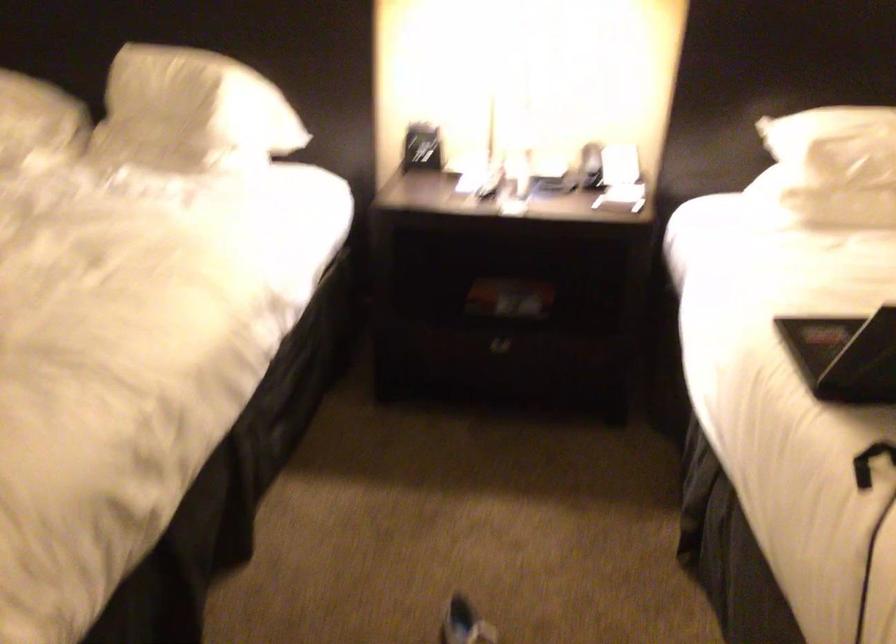
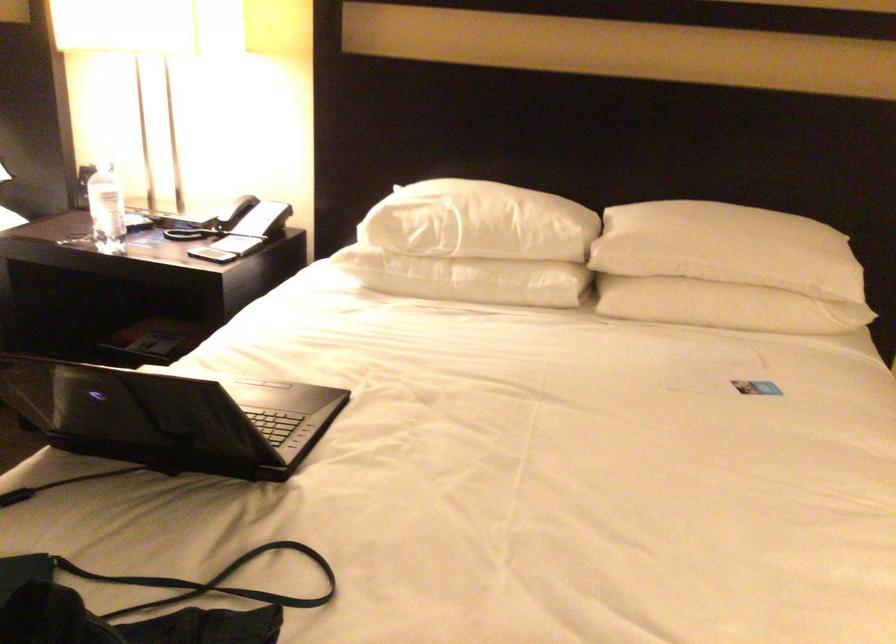
Locate, in the second image, the point that corresponds to point (522, 156) in the first image.

(106, 210)